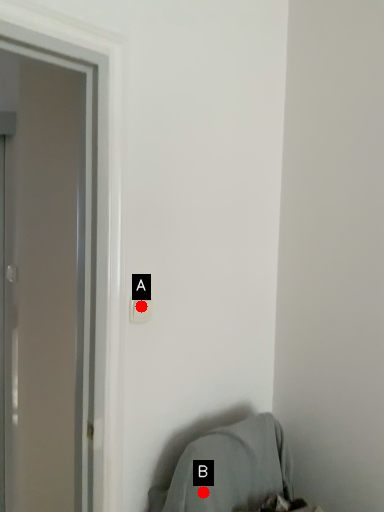
Question: Two points are circled on the image, labeled by A and B beside each circle. Which of the following is the closest to the observer?

Choices:
 (A) A is closer
 (B) B is closer

Answer: (B)